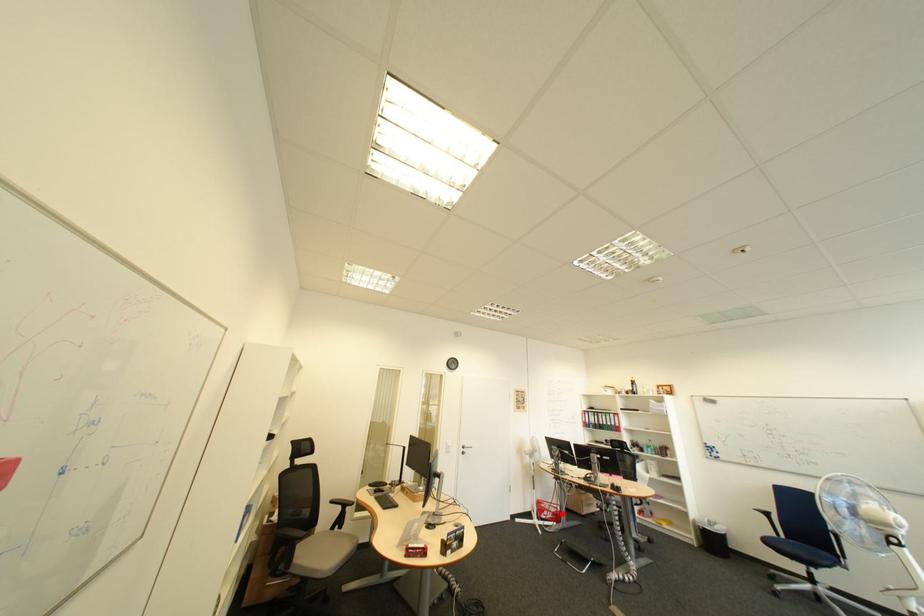
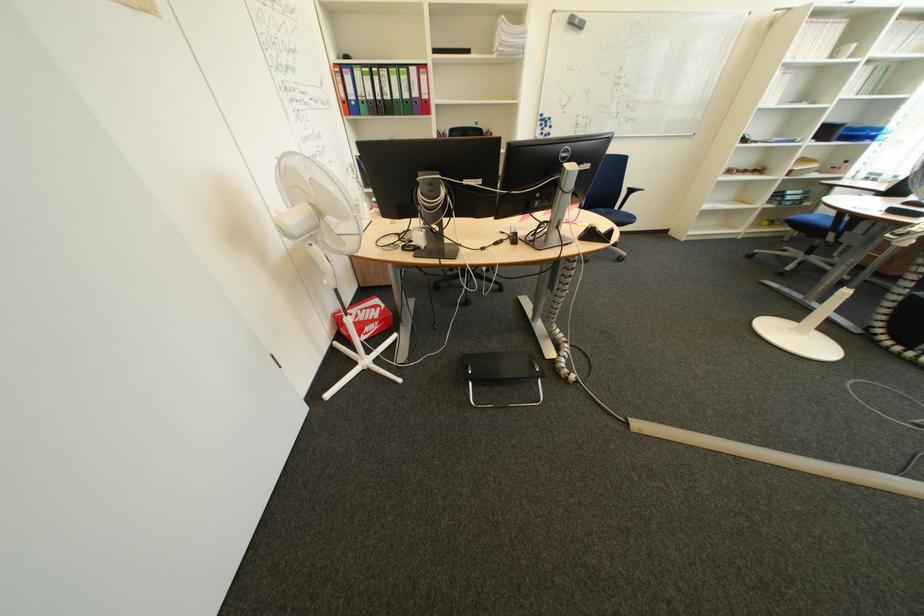
Question: A red point is marked in image1. In image2, is the corresponding 3D point closer to the camera or farther? Reply with the corresponding letter.

Choices:
 (A) The corresponding 3D point is closer.
 (B) The corresponding 3D point is farther.

Answer: (A)